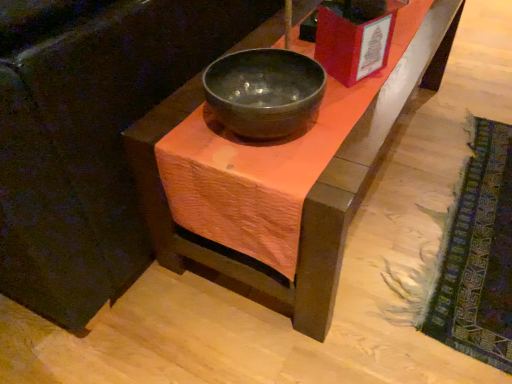
Question: From the image's perspective, relative to textured woolen mat at lower right, is matte black bowl at center above or below?

Choices:
 (A) above
 (B) below

Answer: (A)

Question: Would you say matte black bowl at center is to the left or to the right of textured woolen mat at lower right in the picture?

Choices:
 (A) left
 (B) right

Answer: (A)

Question: Estimate the real-world distances between objects in this image. Which object is closer to the matte black bowl at center?

Choices:
 (A) matte black bowl at center
 (B) textured woolen mat at lower right

Answer: (A)

Question: Estimate the real-world distances between objects in this image. Which object is closer to the textured woolen mat at lower right?

Choices:
 (A) matte black bowl at center
 (B) matte black bowl at center

Answer: (A)